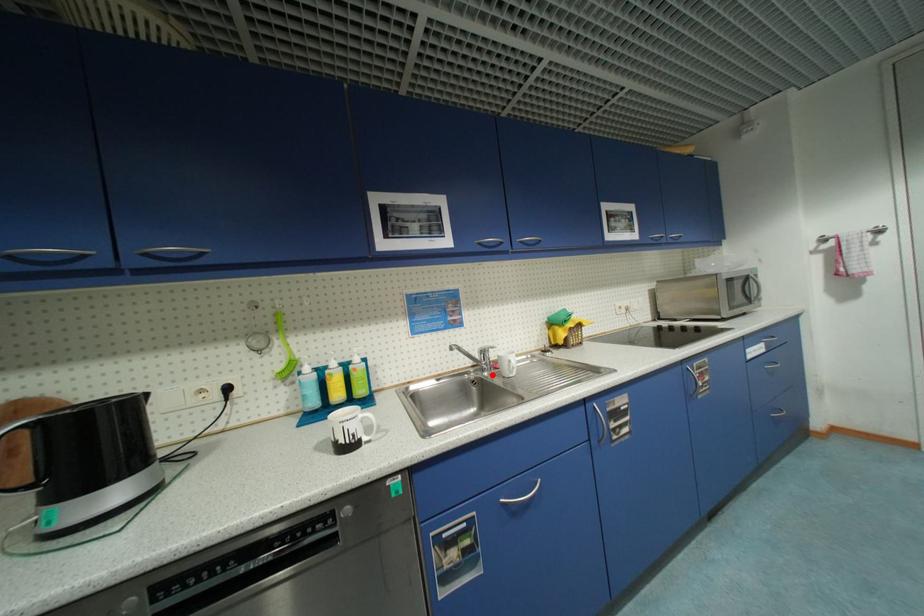
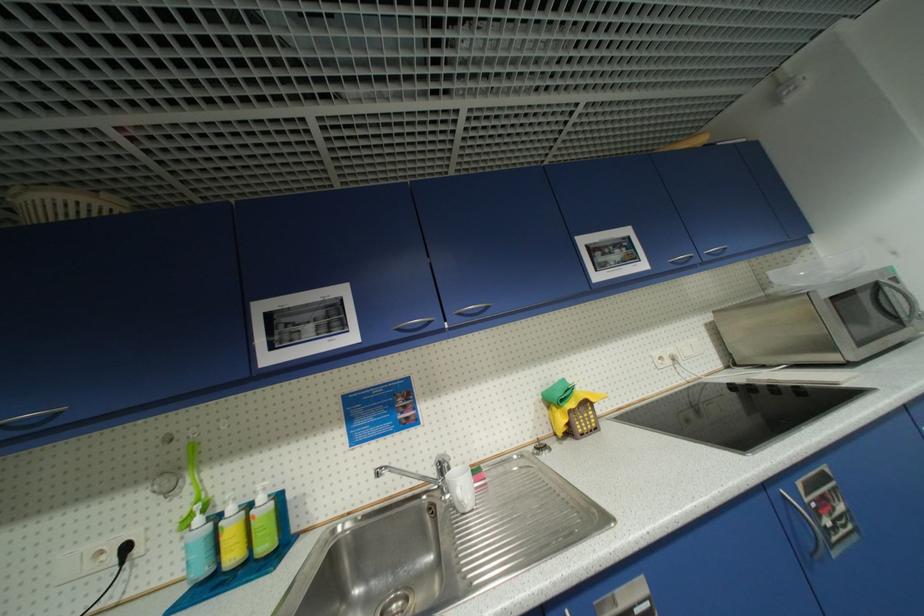
Find the pixel in the second image that matches the highlighted location in the first image.

(454, 496)